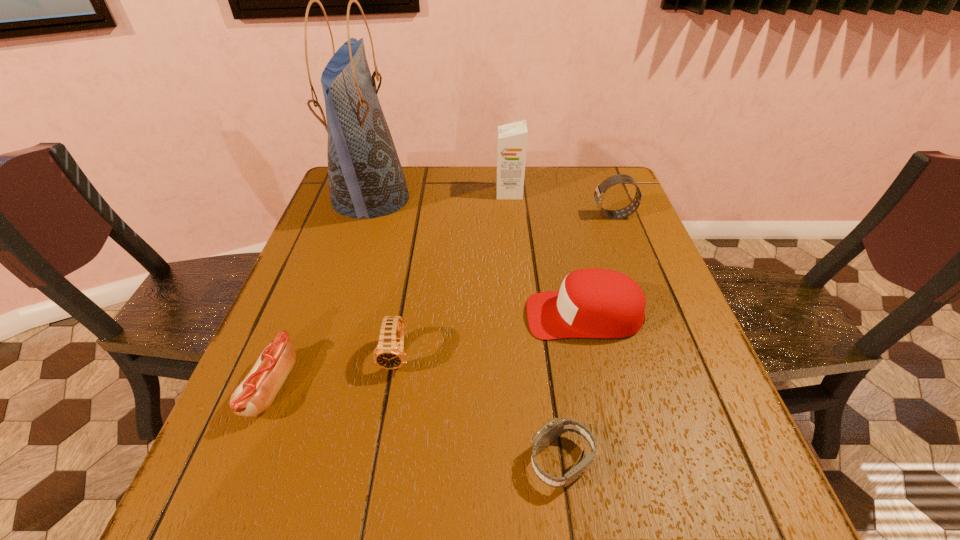
Locate an element on the screen. shopping bag is located at coordinates (312, 539).

Locate an element on the screen. The image size is (960, 540). the second tallest object is located at coordinates (312, 539).

In order to click on the farthest watch in this screenshot , I will do `click(312, 539)`.

This screenshot has width=960, height=540. What are the coordinates of `the rightmost watch` in the screenshot? It's located at (312, 539).

The height and width of the screenshot is (540, 960). What are the coordinates of `baseball cap` in the screenshot? It's located at (312, 539).

You are a GUI agent. You are given a task and a screenshot of the screen. Output one action in this format:
    pyautogui.click(x=<x>, y=<y>)
    Task: Click on the leftmost watch
    
    Given the screenshot: What is the action you would take?
    pyautogui.click(x=312, y=539)

This screenshot has width=960, height=540. I want to click on the fifth object from right to left, so click(x=312, y=539).

The image size is (960, 540). I want to click on the second watch from right to left, so click(x=312, y=539).

At what (x,y) coordinates should I click in order to perform the action: click on the nearest object. Please return your answer as a coordinate pair (x, y). The height and width of the screenshot is (540, 960). Looking at the image, I should click on (312, 539).

Where is `sausage`? This screenshot has width=960, height=540. sausage is located at coordinates (312, 539).